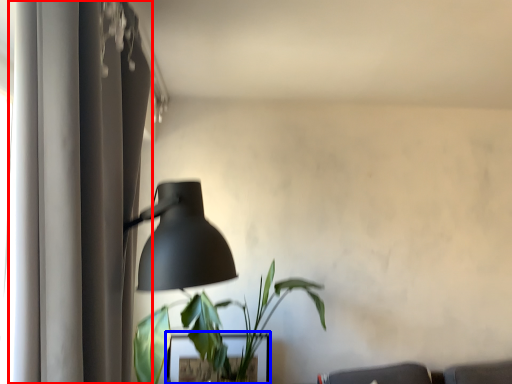
Question: Which point is further to the camera, curtain (highlighted by a red box) or table (highlighted by a blue box)?

Choices:
 (A) curtain
 (B) table

Answer: (B)